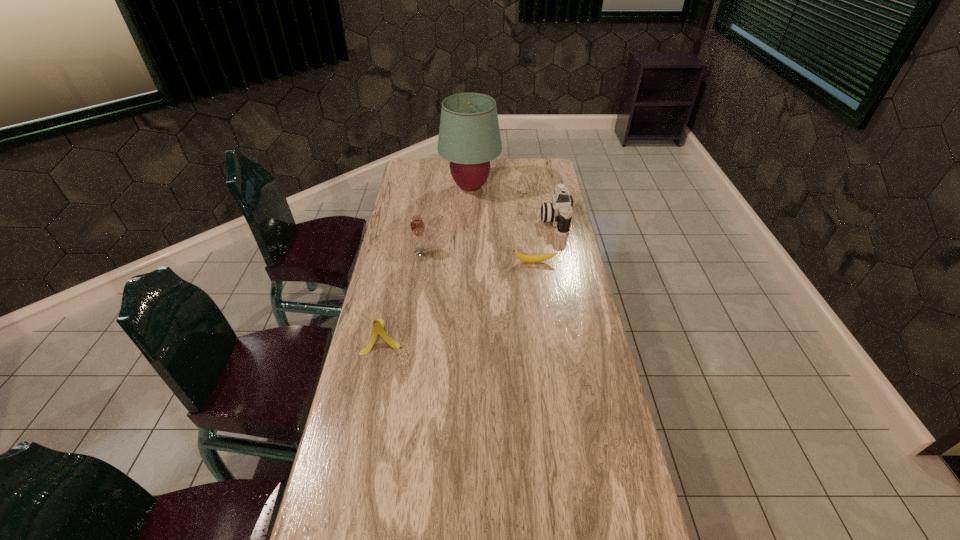
I want to click on unoccupied position between the taller banana and the fourth shortest object, so click(x=402, y=295).

This screenshot has height=540, width=960. I want to click on object that is the nearest to the nearer banana, so click(417, 226).

Identify the location of object that ranks as the fourth closest to the shortest object. This screenshot has width=960, height=540. (378, 325).

The image size is (960, 540). I want to click on free region that satisfies the following two spatial constraints: 1. on the back side of the third object from right to left; 2. on the right side of the fourth tallest object, so click(x=415, y=187).

Where is `vacant space that satisfies the following two spatial constraints: 1. on the back side of the taller banana; 2. on the right side of the second tallest object`? The height and width of the screenshot is (540, 960). vacant space that satisfies the following two spatial constraints: 1. on the back side of the taller banana; 2. on the right side of the second tallest object is located at coordinates (401, 253).

You are a GUI agent. You are given a task and a screenshot of the screen. Output one action in this format:
    pyautogui.click(x=<x>, y=<y>)
    Task: Click on the blank space that satisfies the following two spatial constraints: 1. on the back side of the nearest object; 2. on the left side of the lampshade
    This screenshot has width=960, height=540.
    Given the screenshot: What is the action you would take?
    pyautogui.click(x=415, y=187)

In order to click on vacant area in the image that satisfies the following two spatial constraints: 1. on the front side of the camera; 2. on the left side of the farthest object in this screenshot , I will do `click(469, 219)`.